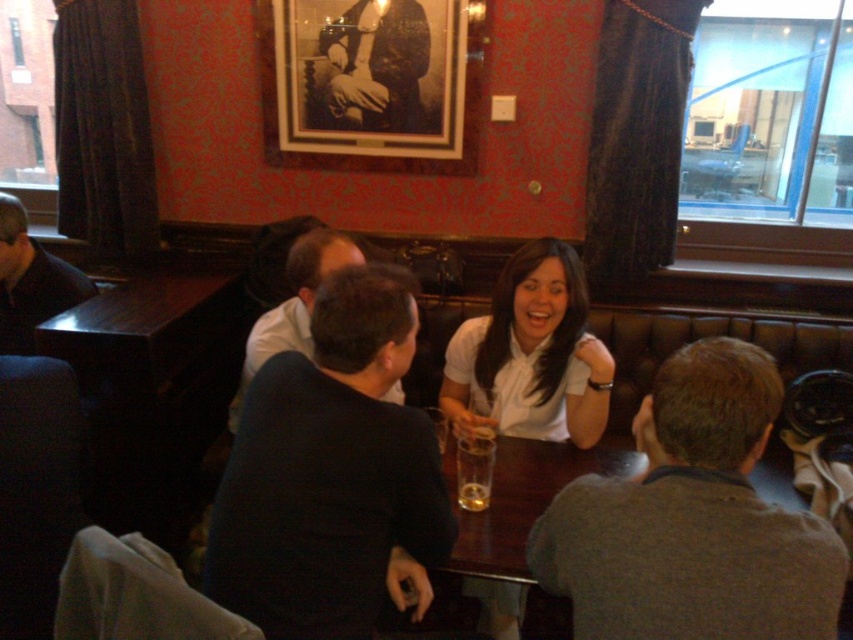
Is black matte picture frame at upper center shorter than translucent glass at table center?

In fact, black matte picture frame at upper center may be taller than translucent glass at table center.

Find the location of a particular element. The height and width of the screenshot is (640, 853). black matte picture frame at upper center is located at coordinates (372, 156).

Which is more to the left, black matte photograph of man at upper center or dark blue shirt at upper left?

From the viewer's perspective, dark blue shirt at upper left appears more on the left side.

Does black matte photograph of man at upper center have a smaller size compared to dark blue shirt at upper left?

No.

Where is `black matte photograph of man at upper center`? black matte photograph of man at upper center is located at coordinates click(x=375, y=67).

Describe the element at coordinates (531, 355) in the screenshot. I see `white matte shirt at center` at that location.

Does white matte shirt at center appear under translucent glass beer at table center?

Incorrect, white matte shirt at center is not positioned below translucent glass beer at table center.

The image size is (853, 640). What do you see at coordinates (531, 355) in the screenshot?
I see `white matte shirt at center` at bounding box center [531, 355].

Where is `white matte shirt at center`? The image size is (853, 640). white matte shirt at center is located at coordinates (531, 355).